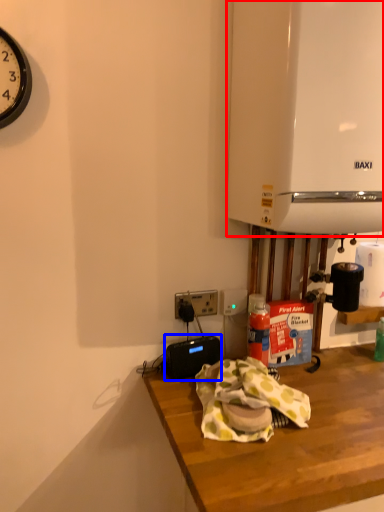
Question: Which object appears closest to the camera in this image, appliance (highlighted by a red box) or appliance (highlighted by a blue box)?

Choices:
 (A) appliance
 (B) appliance

Answer: (A)